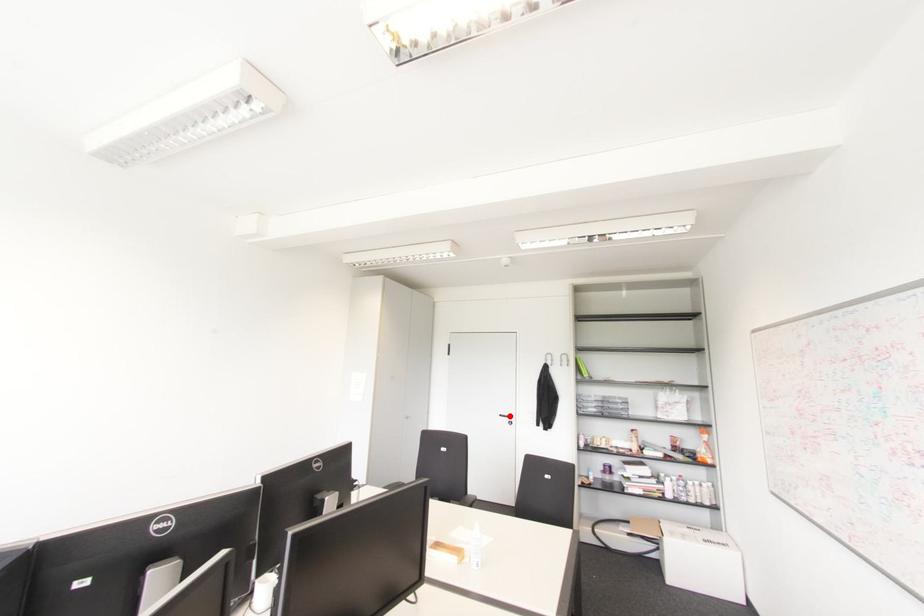
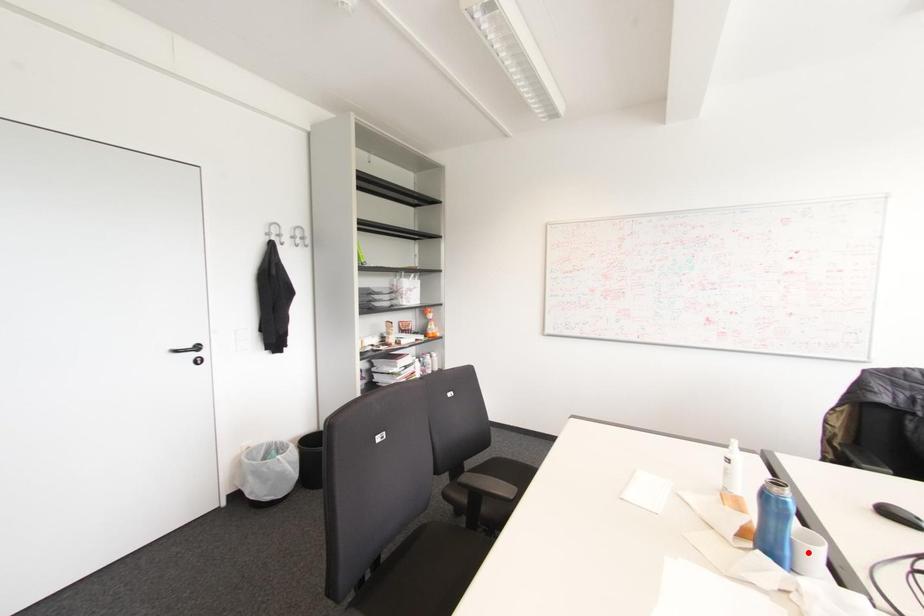
I am providing you with two images of the same scene from different viewpoints. A red point is marked on the first image and another point is marked on the second image. Does the point marked in image1 correspond to the same location as the one in image2?

No